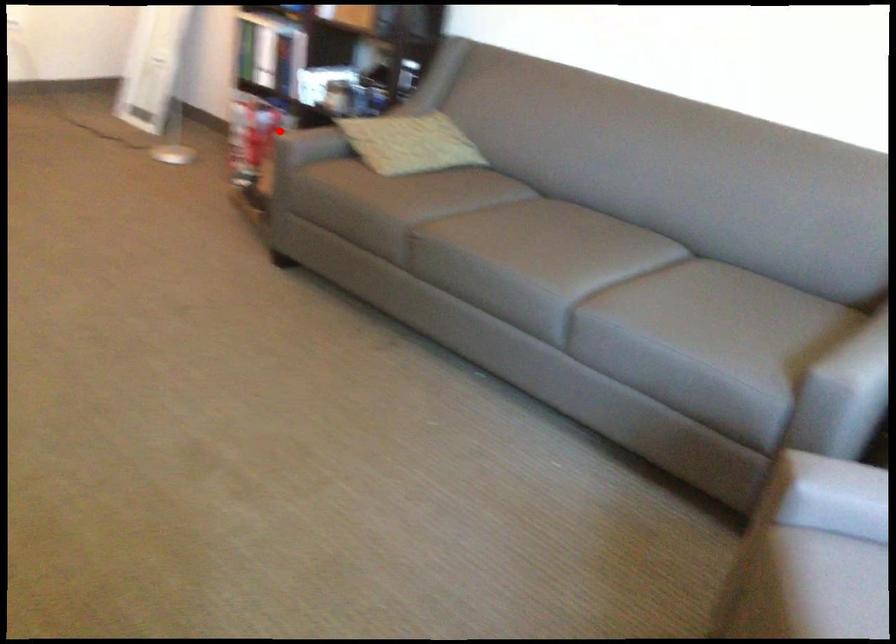
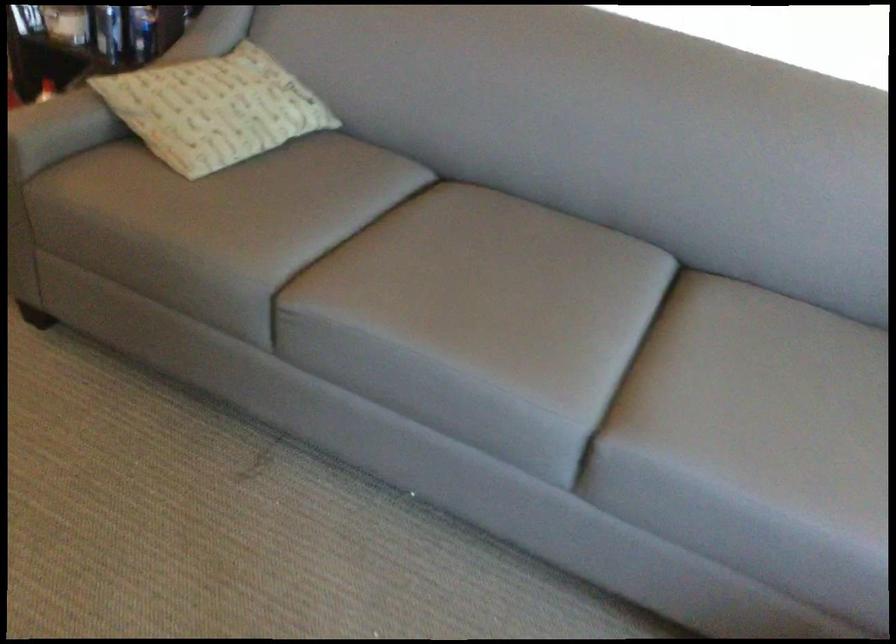
Where in the second image is the point corresponding to the highlighted location from the first image?

(32, 125)